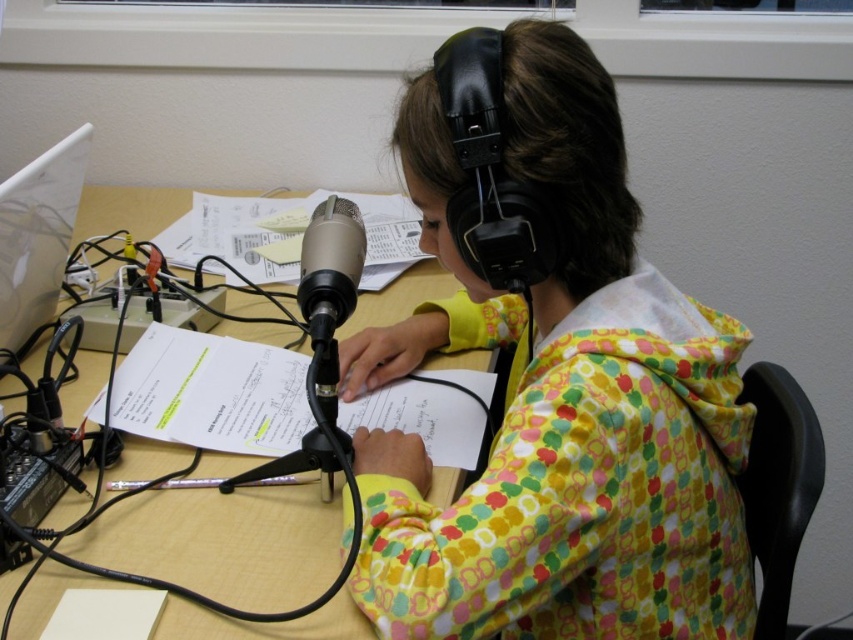
You are setting up a desk for a video call and need to place the white paper at center and the white plastic laptop at left. According to the scene, where should you position the white paper relative to the white plastic laptop?

The white paper at center should be positioned above the white plastic laptop at left as it is located above it in the scene.

You are organizing the desk and need to know which paper takes up more space. Which one is larger between the yellow paper at center and the white paper at center?

→ The white paper at center is larger because the yellow paper at center occupies less space than it.